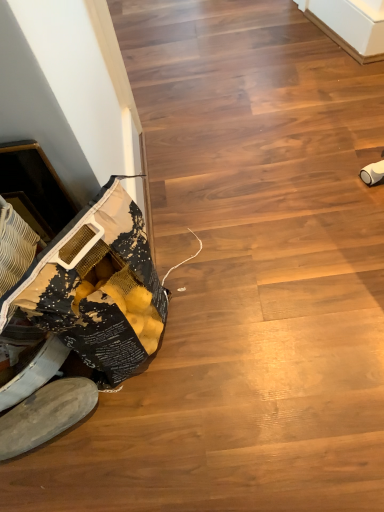
Question: Is white suede shoe at lower left aimed at wooden floor at lower left?

Choices:
 (A) no
 (B) yes

Answer: (A)

Question: Can you confirm if white suede shoe at lower left is bigger than wooden floor at lower left?

Choices:
 (A) yes
 (B) no

Answer: (B)

Question: Are white suede shoe at lower left and wooden floor at lower left located far from each other?

Choices:
 (A) yes
 (B) no

Answer: (B)

Question: Is white suede shoe at lower left wider than wooden floor at lower left?

Choices:
 (A) no
 (B) yes

Answer: (A)

Question: Is the depth of white suede shoe at lower left greater than that of wooden floor at lower left?

Choices:
 (A) no
 (B) yes

Answer: (B)

Question: Considering the relative sizes of white suede shoe at lower left and wooden floor at lower left in the image provided, is white suede shoe at lower left taller than wooden floor at lower left?

Choices:
 (A) yes
 (B) no

Answer: (A)

Question: Can you confirm if wooden floor at lower left is thinner than white suede shoe at lower left?

Choices:
 (A) yes
 (B) no

Answer: (B)

Question: Is wooden floor at lower left oriented away from white suede shoe at lower left?

Choices:
 (A) no
 (B) yes

Answer: (A)

Question: Is wooden floor at lower left oriented towards white suede shoe at lower left?

Choices:
 (A) yes
 (B) no

Answer: (B)

Question: Is wooden floor at lower left smaller than white suede shoe at lower left?

Choices:
 (A) no
 (B) yes

Answer: (A)

Question: Would you say wooden floor at lower left is a long distance from white suede shoe at lower left?

Choices:
 (A) no
 (B) yes

Answer: (A)

Question: From the image's perspective, is wooden floor at lower left under white suede shoe at lower left?

Choices:
 (A) no
 (B) yes

Answer: (A)

Question: Considering their positions, is white suede shoe at lower left located in front of or behind wooden floor at lower left?

Choices:
 (A) front
 (B) behind

Answer: (B)